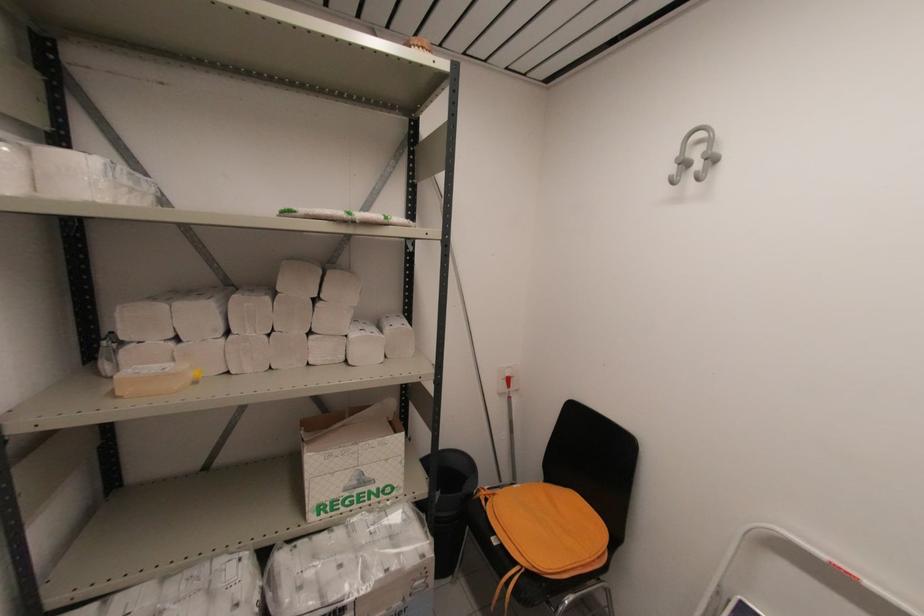
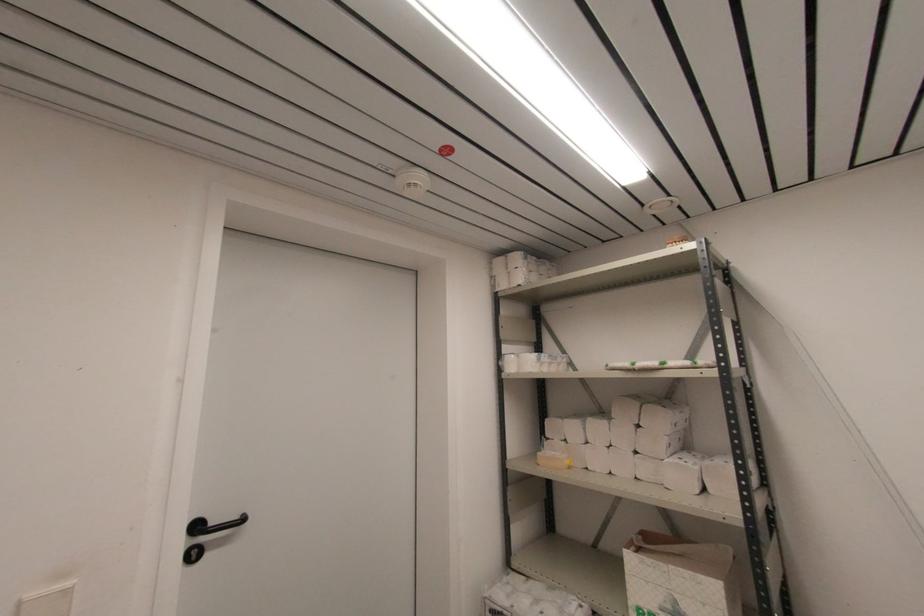
Where in the second image is the point corresponding to (311,333) from the first image?

(637, 453)